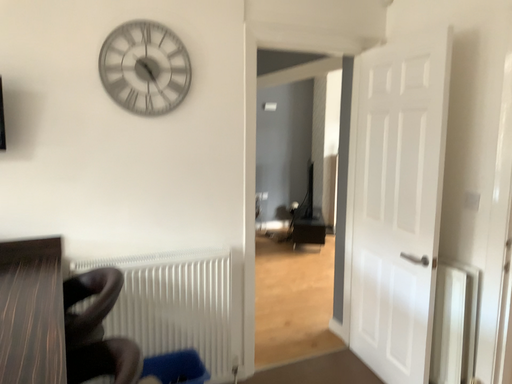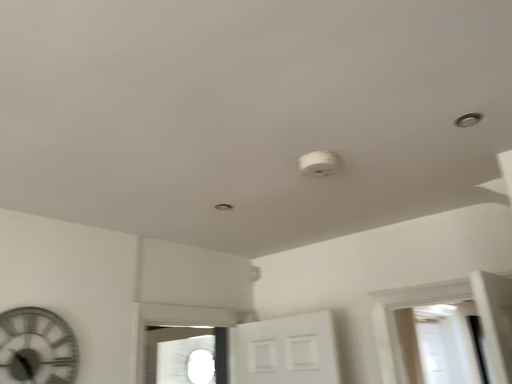
Question: Which way did the camera rotate in the video?

Choices:
 (A) rotated downward
 (B) rotated upward

Answer: (B)